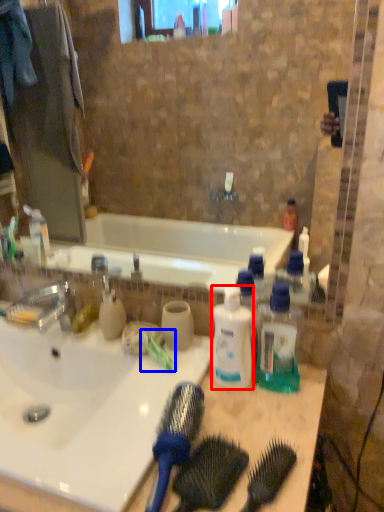
Question: Which object appears closest to the camera in this image, bottle (highlighted by a red box) or toothbrush (highlighted by a blue box)?

Choices:
 (A) bottle
 (B) toothbrush

Answer: (A)